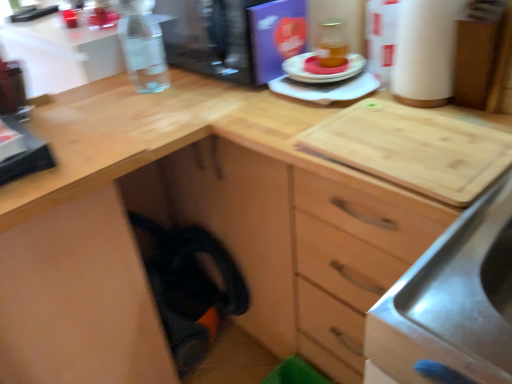
The height and width of the screenshot is (384, 512). In order to click on vacant space in front of clear glass bottle at upper left in this screenshot , I will do `click(138, 110)`.